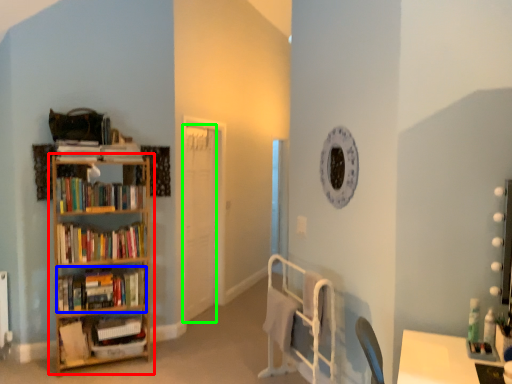
Question: Which is nearer to the shelf (highlighted by a red box)? book (highlighted by a blue box) or door (highlighted by a green box).

Choices:
 (A) book
 (B) door

Answer: (A)